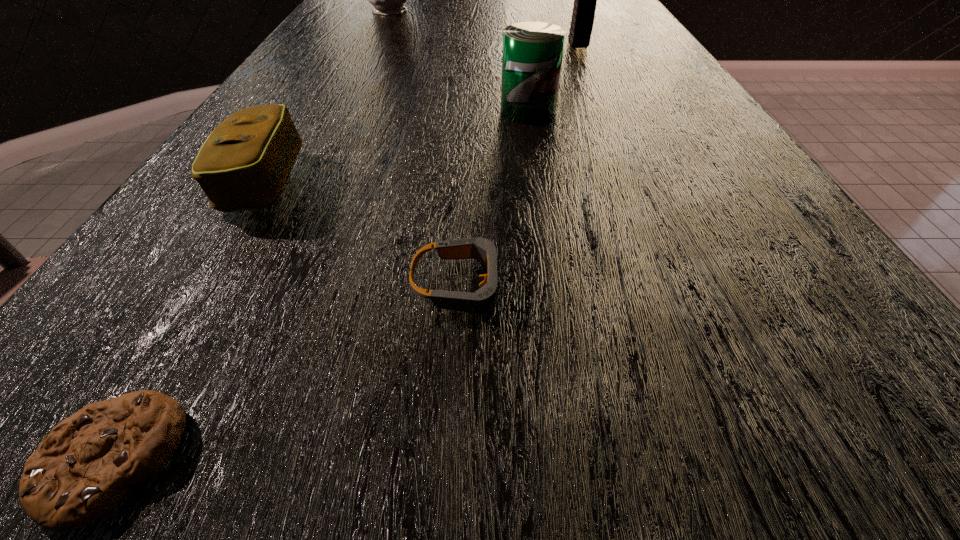
The width and height of the screenshot is (960, 540). Find the location of `chinaware`. chinaware is located at coordinates (387, 0).

The width and height of the screenshot is (960, 540). Find the location of `the rightmost object`. the rightmost object is located at coordinates (585, 0).

I want to click on the second farthest object, so click(585, 0).

What are the coordinates of `can` in the screenshot? It's located at click(532, 58).

At what (x,y) coordinates should I click in order to perform the action: click on the fifth object from left to right. Please return your answer as a coordinate pair (x, y). The height and width of the screenshot is (540, 960). Looking at the image, I should click on (532, 58).

Find the location of a particular element. The image size is (960, 540). the nearer clutch bag is located at coordinates (244, 164).

Identify the location of the fourth tallest object. The image size is (960, 540). (244, 164).

I want to click on the third object from right to left, so click(483, 301).

Identify the location of goggles. The height and width of the screenshot is (540, 960). (483, 301).

The width and height of the screenshot is (960, 540). Find the location of `free space located on the right of the chinaware`. free space located on the right of the chinaware is located at coordinates pyautogui.click(x=468, y=11).